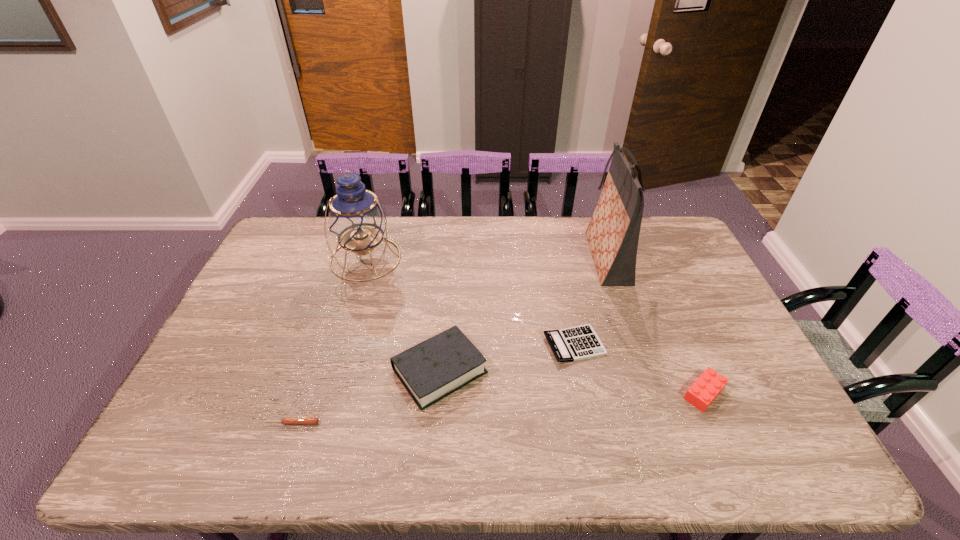
In the image, there is a desktop. Where is `vacant space at the right edge`? The image size is (960, 540). vacant space at the right edge is located at coordinates (714, 348).

What are the coordinates of `free space at the far left corner of the desktop` in the screenshot? It's located at (312, 236).

This screenshot has width=960, height=540. What are the coordinates of `free point at the far right corner` in the screenshot? It's located at click(x=664, y=217).

This screenshot has width=960, height=540. Identify the location of free location at the near right corner of the desktop. (796, 436).

Locate an element on the screen. Image resolution: width=960 pixels, height=540 pixels. unoccupied position between the calculator and the second tallest object is located at coordinates (470, 301).

Where is `free space between the sausage and the fourth object from right to left`? The width and height of the screenshot is (960, 540). free space between the sausage and the fourth object from right to left is located at coordinates (366, 397).

Locate an element on the screen. This screenshot has width=960, height=540. vacant region between the calculator and the shopping bag is located at coordinates (590, 301).

Find the location of a particular element. The width and height of the screenshot is (960, 540). free space between the lantern and the calculator is located at coordinates (470, 301).

Locate an element on the screen. Image resolution: width=960 pixels, height=540 pixels. blank region between the shopping bag and the third tallest object is located at coordinates (523, 314).

The image size is (960, 540). I want to click on free space between the fourth shortest object and the shopping bag, so click(x=523, y=314).